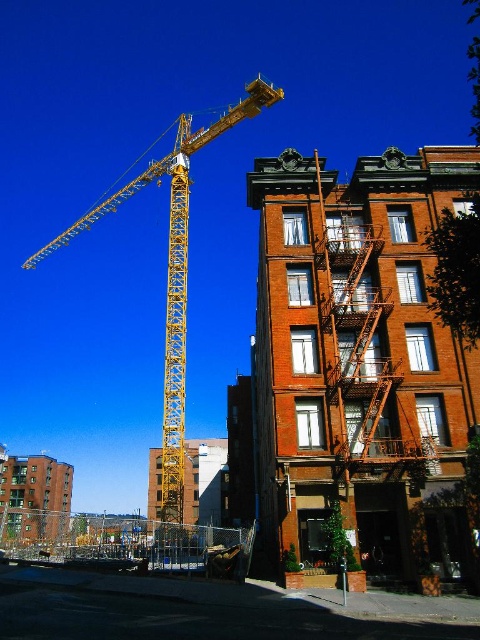
Question: Among these objects, which one is farthest from the camera?

Choices:
 (A) yellow metallic crane at upper left
 (B) rusty metal fire escape at center-right

Answer: (A)

Question: Among these points, which one is nearest to the camera?

Choices:
 (A) (381, 550)
 (B) (167, 506)
 (C) (405, 452)

Answer: (C)

Question: Does brick building at center have a larger size compared to yellow metallic crane at upper left?

Choices:
 (A) no
 (B) yes

Answer: (A)

Question: Is brick building at center positioned before yellow metallic crane at upper left?

Choices:
 (A) yes
 (B) no

Answer: (A)

Question: Considering the real-world distances, which object is closest to the rusty metal fire escape at center-right?

Choices:
 (A) brick building at center
 (B) yellow metallic crane at upper left

Answer: (A)

Question: Is brick building at center further to camera compared to yellow metallic crane at upper left?

Choices:
 (A) no
 (B) yes

Answer: (A)